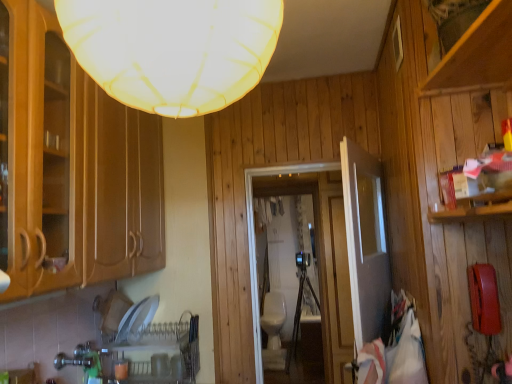
Question: Is the surface of white fabric lampshade at upper center in direct contact with transparent glass door at center?

Choices:
 (A) yes
 (B) no

Answer: (B)

Question: Can you confirm if white fabric lampshade at upper center is taller than transparent glass door at center?

Choices:
 (A) no
 (B) yes

Answer: (A)

Question: From a real-world perspective, is white fabric lampshade at upper center physically above transparent glass door at center?

Choices:
 (A) yes
 (B) no

Answer: (A)

Question: Can you confirm if white fabric lampshade at upper center is shorter than transparent glass door at center?

Choices:
 (A) yes
 (B) no

Answer: (A)

Question: Can you confirm if white fabric lampshade at upper center is bigger than transparent glass door at center?

Choices:
 (A) yes
 (B) no

Answer: (A)

Question: Is white fabric lampshade at upper center oriented towards transparent glass door at center?

Choices:
 (A) no
 (B) yes

Answer: (B)

Question: Is brushed metal faucet at lower left closer to camera compared to white glossy door at center?

Choices:
 (A) yes
 (B) no

Answer: (B)

Question: Is brushed metal faucet at lower left with white glossy door at center?

Choices:
 (A) no
 (B) yes

Answer: (A)

Question: Considering the relative positions of brushed metal faucet at lower left and white glossy door at center in the image provided, is brushed metal faucet at lower left to the right of white glossy door at center from the viewer's perspective?

Choices:
 (A) no
 (B) yes

Answer: (A)

Question: Is brushed metal faucet at lower left not inside white glossy door at center?

Choices:
 (A) yes
 (B) no

Answer: (A)

Question: Can you confirm if brushed metal faucet at lower left is thinner than white glossy door at center?

Choices:
 (A) no
 (B) yes

Answer: (A)

Question: Is brushed metal faucet at lower left not close to white glossy door at center?

Choices:
 (A) yes
 (B) no

Answer: (A)

Question: From the image's perspective, is white glossy sink at center above transparent glass door at center?

Choices:
 (A) no
 (B) yes

Answer: (A)